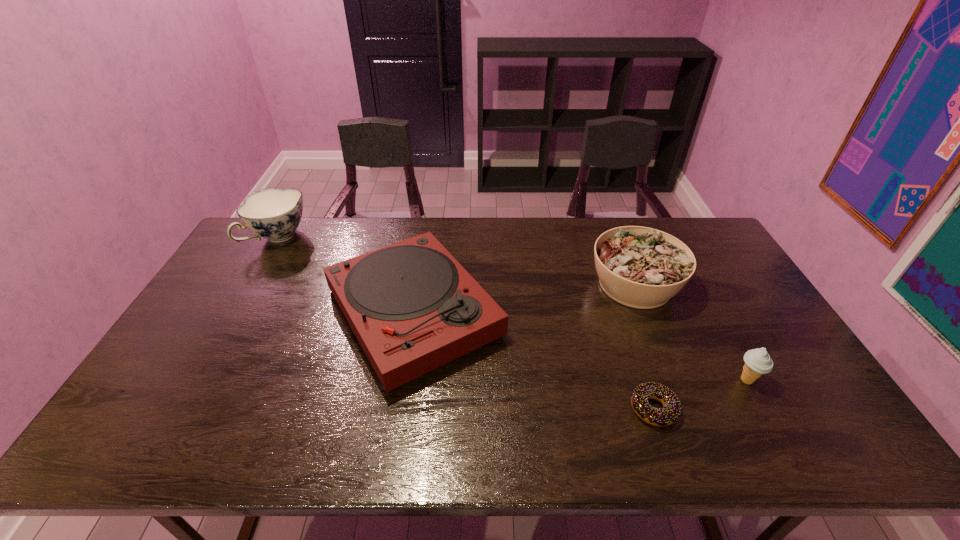
This screenshot has height=540, width=960. I want to click on chinaware located in the far edge section of the desktop, so click(274, 214).

Find the location of `salad that is at the far edge`. salad that is at the far edge is located at coordinates (640, 267).

The height and width of the screenshot is (540, 960). In order to click on record player present at the far edge in this screenshot , I will do `click(411, 305)`.

I want to click on object that is at the near edge, so click(670, 412).

At what (x,y) coordinates should I click in order to perform the action: click on object present at the left edge. Please return your answer as a coordinate pair (x, y). This screenshot has height=540, width=960. Looking at the image, I should click on (274, 214).

What are the coordinates of `object that is at the right edge` in the screenshot? It's located at (757, 361).

Identify the location of object present at the far left corner. Image resolution: width=960 pixels, height=540 pixels. (274, 214).

The height and width of the screenshot is (540, 960). I want to click on free region at the far edge of the desktop, so [x=488, y=249].

Where is `vacant space at the near edge of the desktop`? Image resolution: width=960 pixels, height=540 pixels. vacant space at the near edge of the desktop is located at coordinates (456, 438).

This screenshot has height=540, width=960. Find the location of `vacant region at the left edge of the desktop`. vacant region at the left edge of the desktop is located at coordinates (211, 358).